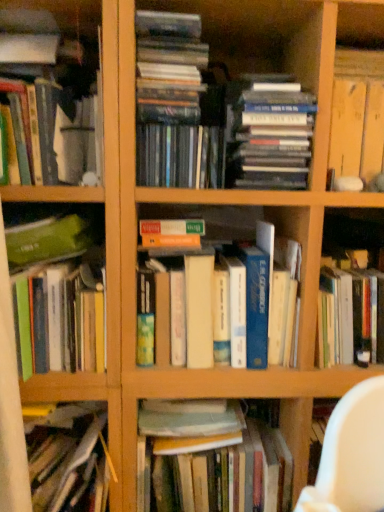
Question: Can you confirm if hardcover book at bottom center, placed as the 1th book when sorted from bottom to top, is thinner than matte white vase at upper left, the 7th book when ordered from bottom to top?

Choices:
 (A) no
 (B) yes

Answer: (B)

Question: Can you confirm if hardcover book at bottom center, placed as the 1th book when sorted from bottom to top, is taller than matte white vase at upper left, the fourth book from the top?

Choices:
 (A) no
 (B) yes

Answer: (A)

Question: Can you confirm if hardcover book at bottom center, placed as the 1th book when sorted from bottom to top, is shorter than matte white vase at upper left, the fourth book from the top?

Choices:
 (A) yes
 (B) no

Answer: (A)

Question: Is hardcover book at bottom center, which is counted as the 10th book, starting from the top, facing away from matte white vase at upper left, the 7th book when ordered from bottom to top?

Choices:
 (A) yes
 (B) no

Answer: (B)

Question: From a real-world perspective, is hardcover book at bottom center, which is counted as the 10th book, starting from the top, physically above matte white vase at upper left, the 7th book when ordered from bottom to top?

Choices:
 (A) no
 (B) yes

Answer: (A)

Question: Is hardcover book at bottom center, placed as the 1th book when sorted from bottom to top, completely or partially outside of matte white vase at upper left, the fourth book from the top?

Choices:
 (A) no
 (B) yes

Answer: (B)

Question: Does hardcover books at center, which is the fourth book in bottom-to-top order, have a lesser width compared to green matte book at left, the third book ordered from the bottom?

Choices:
 (A) yes
 (B) no

Answer: (A)

Question: Is green matte book at left, the third book ordered from the bottom, at the back of hardcover books at center, which is the fourth book in bottom-to-top order?

Choices:
 (A) yes
 (B) no

Answer: (B)

Question: Could you tell me if hardcover books at center, which is the fourth book in bottom-to-top order, is turned towards green matte book at left, the third book ordered from the bottom?

Choices:
 (A) no
 (B) yes

Answer: (A)

Question: Does hardcover books at center, which is the fourth book in bottom-to-top order, appear on the right side of green matte book at left, the eighth book in the top-to-bottom sequence?

Choices:
 (A) no
 (B) yes

Answer: (B)

Question: Does hardcover books at center, the 7th book in the top-to-bottom sequence, have a lesser height compared to green matte book at left, the eighth book in the top-to-bottom sequence?

Choices:
 (A) no
 (B) yes

Answer: (A)

Question: Does hardcover books at center, which is the fourth book in bottom-to-top order, lie in front of green matte book at left, the third book ordered from the bottom?

Choices:
 (A) yes
 (B) no

Answer: (B)

Question: Are matte white vase at upper left, the 7th book when ordered from bottom to top, and hardcover books at center, the 7th book in the top-to-bottom sequence, located far from each other?

Choices:
 (A) yes
 (B) no

Answer: (B)